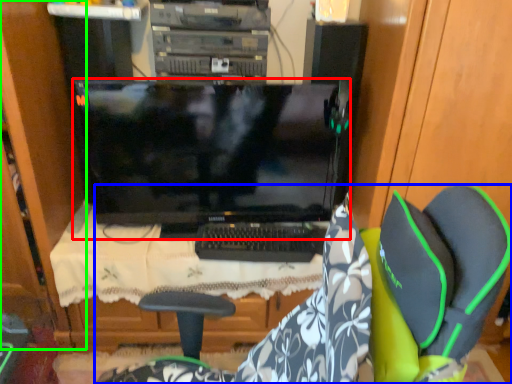
Question: Based on their relative distances, which object is farther from computer monitor (highlighted by a red box)? Choose from chair (highlighted by a blue box) and dresser (highlighted by a green box).

Choices:
 (A) chair
 (B) dresser

Answer: (A)